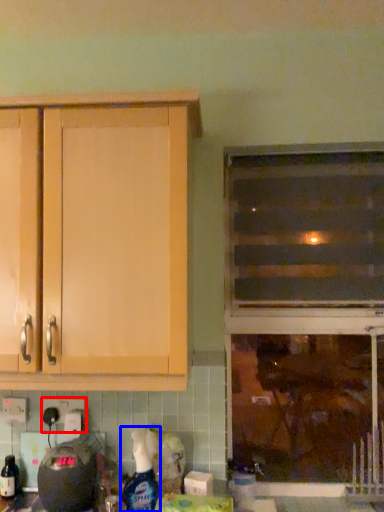
Question: Which of the following is the closest to the observer, electric outlet (highlighted by a red box) or cleaning product (highlighted by a blue box)?

Choices:
 (A) electric outlet
 (B) cleaning product

Answer: (B)